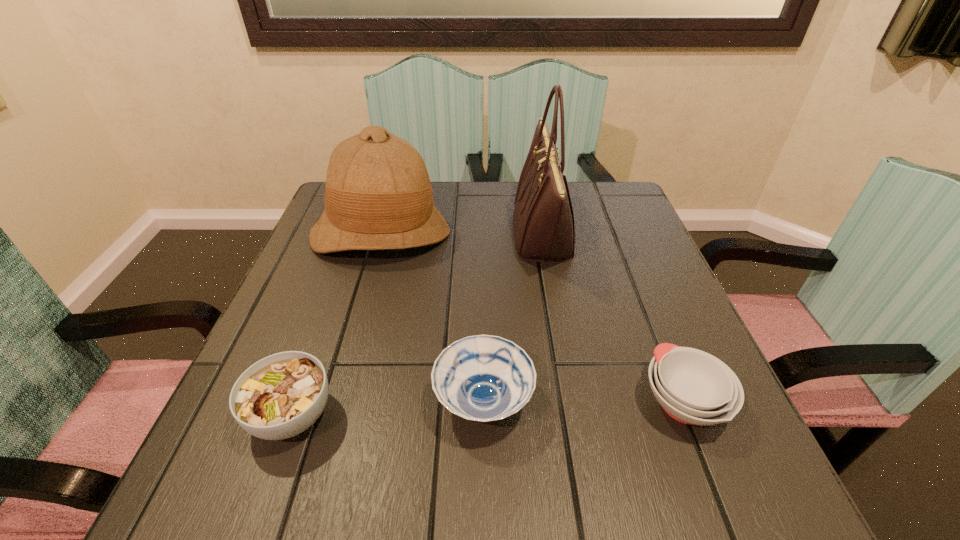
The image size is (960, 540). I want to click on vacant space located on the front of the second soup bowl from left to right, so click(484, 482).

Where is `vacant space located 0.200m on the left of the rightmost object`? This screenshot has width=960, height=540. vacant space located 0.200m on the left of the rightmost object is located at coordinates (516, 401).

At what (x,y) coordinates should I click in order to perform the action: click on handbag that is at the far edge. Please return your answer as a coordinate pair (x, y). Image resolution: width=960 pixels, height=540 pixels. Looking at the image, I should click on (543, 219).

Image resolution: width=960 pixels, height=540 pixels. In order to click on hat that is at the far edge in this screenshot , I will do `click(378, 195)`.

Locate an element on the screen. This screenshot has width=960, height=540. object that is positioned at the near edge is located at coordinates (278, 397).

Identify the location of hat that is positioned at the left edge. (378, 195).

I want to click on soup bowl present at the left edge, so click(x=278, y=397).

You are a GUI agent. You are given a task and a screenshot of the screen. Output one action in this format:
    pyautogui.click(x=<x>, y=<y>)
    Task: Click on the object situated at the right edge
    This screenshot has height=540, width=960.
    Given the screenshot: What is the action you would take?
    pyautogui.click(x=693, y=387)

Identify the location of object that is positioned at the far left corner. (378, 195).

Where is `object located at the near left corner`? This screenshot has width=960, height=540. object located at the near left corner is located at coordinates (278, 397).